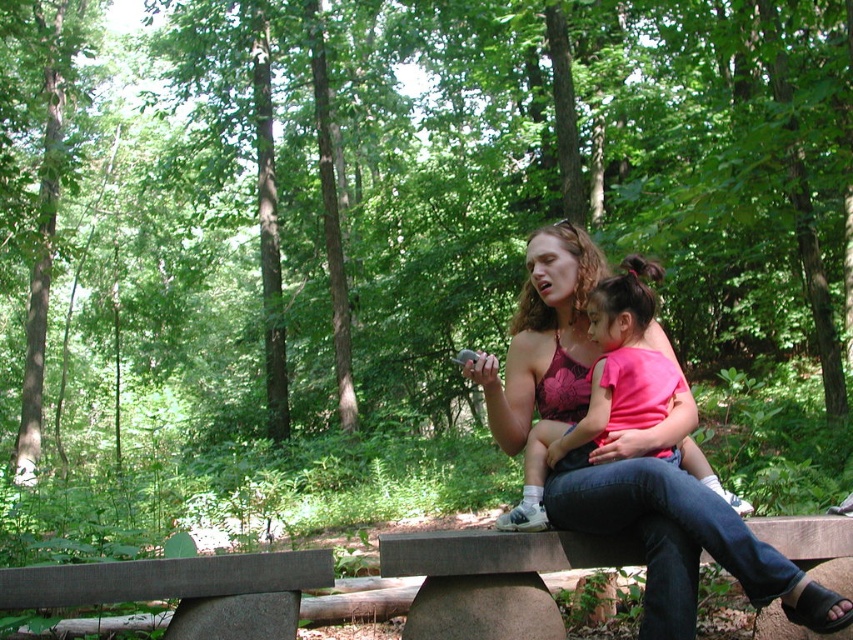
Which is more to the right, matte pink tank top at center or pink fabric baby at center?

pink fabric baby at center

Is point (521, 385) closer to camera compared to point (653, 397)?

No, it is not.

Is point (558, 298) positioned before point (596, 310)?

No.

This screenshot has width=853, height=640. Identify the location of matte pink tank top at center. (675, 525).

Is gray concrete bench at center positioned in front of pink fabric baby at center?

Yes, gray concrete bench at center is in front of pink fabric baby at center.

How distant is gray concrete bench at center from pink fabric baby at center?

gray concrete bench at center is 15.38 inches away from pink fabric baby at center.

What are the coordinates of `gray concrete bench at center` in the screenshot? It's located at (532, 577).

At what (x,y) coordinates should I click in order to perform the action: click on gray concrete bench at center. Please return your answer as a coordinate pair (x, y). The image size is (853, 640). Looking at the image, I should click on (532, 577).

Who is lower down, matte pink tank top at center or gray concrete bench at center?

Positioned lower is gray concrete bench at center.

At what (x,y) coordinates should I click in order to perform the action: click on matte pink tank top at center. Please return your answer as a coordinate pair (x, y). Looking at the image, I should click on (675, 525).

Find the location of a particular element. Image resolution: width=853 pixels, height=640 pixels. matte pink tank top at center is located at coordinates (675, 525).